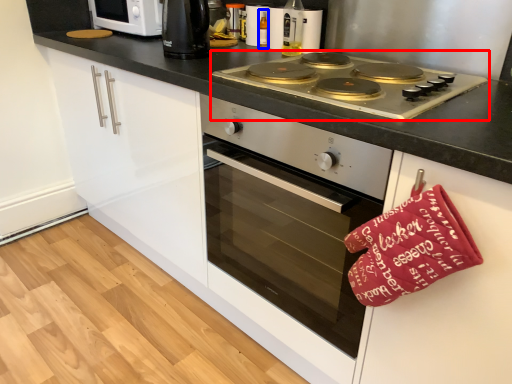
Question: Which of the following is the farthest to the observer, gas stove (highlighted by a red box) or bottle (highlighted by a blue box)?

Choices:
 (A) gas stove
 (B) bottle

Answer: (B)